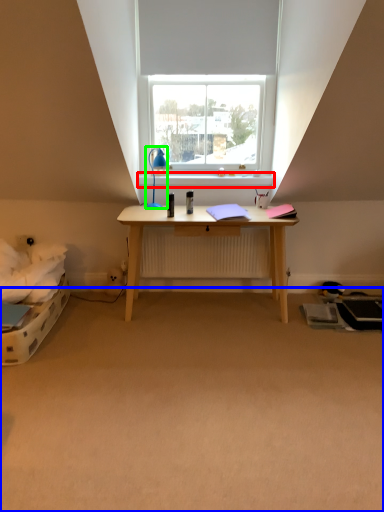
Question: Which object is the farthest from window sill (highlighted by a red box)? Choose among these: plain (highlighted by a blue box) or lamp (highlighted by a green box).

Choices:
 (A) plain
 (B) lamp

Answer: (A)